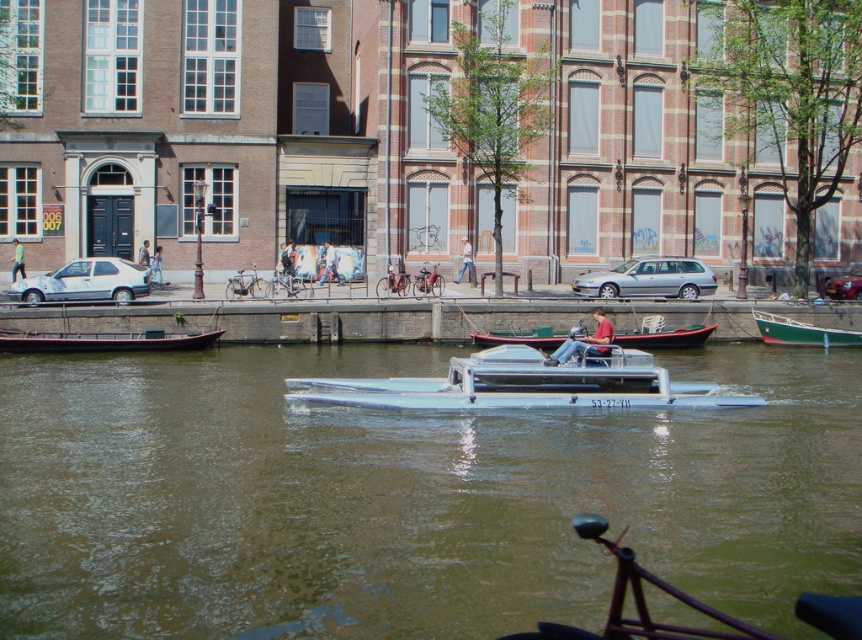
You are a tourist standing at the canal edge. You see the metallic silver boat at center and the white matte car at left. Which object is closer to the water surface?

The metallic silver boat at center is closer to the water surface because it is located below the white matte car at left.

You are a tourist standing at the canal edge, wanting to take a photo of both the white matte car at left and the wooden boat at center. Which object should you focus on first to ensure both are in the frame?

You should focus on the white matte car at left first since it is closer to you than the wooden boat at center, allowing you to frame both objects in the photo.

You are a delivery driver who needs to park your vehicle in this area. You have a white matte car at left and a wooden boat at center available for parking. Which vehicle should you choose if you want to park closer to the canal edge?

The wooden boat at center should be chosen because boats are typically docked near canals, making it easier to park closer to the canal edge compared to the white matte car at left which would need to be parked on land.